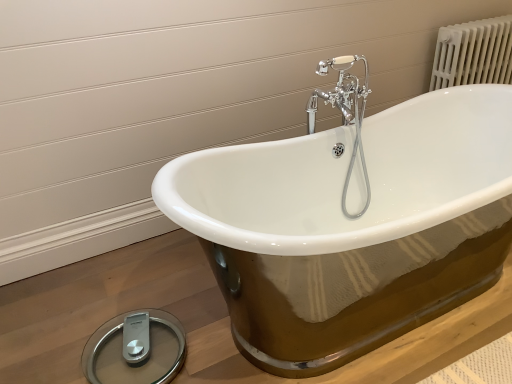
Locate an element on the screen. The height and width of the screenshot is (384, 512). white porcelain bathtub at center is located at coordinates (352, 226).

You are a GUI agent. You are given a task and a screenshot of the screen. Output one action in this format:
    pyautogui.click(x=<x>, y=<y>)
    Task: Click on the silver/glass scale at lower left
    
    Given the screenshot: What is the action you would take?
    pyautogui.click(x=135, y=349)

You are a GUI agent. You are given a task and a screenshot of the screen. Output one action in this format:
    pyautogui.click(x=<x>, y=<y>)
    Task: Click on the scale to the left of chrome/metallic faucet at upper center
    The image size is (512, 384).
    Given the screenshot: What is the action you would take?
    pyautogui.click(x=135, y=349)

Which object is closer to the camera, chrome/metallic faucet at upper center or silver/glass scale at lower left?

silver/glass scale at lower left is more forward.

Is chrome/metallic faucet at upper center to the left of silver/glass scale at lower left from the viewer's perspective?

In fact, chrome/metallic faucet at upper center is to the right of silver/glass scale at lower left.

Would you say chrome/metallic faucet at upper center is outside white porcelain bathtub at center?

Yes.

From their relative heights in the image, would you say chrome/metallic faucet at upper center is taller or shorter than white porcelain bathtub at center?

chrome/metallic faucet at upper center is taller than white porcelain bathtub at center.

From the image's perspective, is chrome/metallic faucet at upper center under white porcelain bathtub at center?

No, from the image's perspective, chrome/metallic faucet at upper center is not below white porcelain bathtub at center.

Considering the positions of points (321, 65) and (229, 176), is point (321, 65) closer to camera compared to point (229, 176)?

Yes, point (321, 65) is in front of point (229, 176).

From a real-world perspective, is white porcelain bathtub at center located beneath silver/glass scale at lower left?

Indeed, from a real-world perspective, white porcelain bathtub at center is positioned beneath silver/glass scale at lower left.

In the image, is white porcelain bathtub at center on the left side or the right side of silver/glass scale at lower left?

white porcelain bathtub at center is positioned on silver/glass scale at lower left's right side.

Which of these two, white porcelain bathtub at center or silver/glass scale at lower left, stands shorter?

white porcelain bathtub at center.

Is point (173, 315) closer to camera compared to point (360, 126)?

Yes, point (173, 315) is in front of point (360, 126).

Consider the image. From the image's perspective, which one is positioned higher, silver/glass scale at lower left or chrome/metallic faucet at upper center?

chrome/metallic faucet at upper center is shown above in the image.

Does silver/glass scale at lower left contain white porcelain bathtub at center?

No, silver/glass scale at lower left does not contain white porcelain bathtub at center.

Does silver/glass scale at lower left come in front of white porcelain bathtub at center?

No.

Who is bigger, silver/glass scale at lower left or white porcelain bathtub at center?

Bigger between the two is white porcelain bathtub at center.

Which is more to the left, white porcelain bathtub at center or chrome/metallic faucet at upper center?

Positioned to the left is chrome/metallic faucet at upper center.

Do you think white porcelain bathtub at center is within chrome/metallic faucet at upper center, or outside of it?

white porcelain bathtub at center is not inside chrome/metallic faucet at upper center, it's outside.

Looking at this image, is chrome/metallic faucet at upper center at the back of white porcelain bathtub at center?

No.

How different are the orientations of white porcelain bathtub at center and chrome/metallic faucet at upper center in degrees?

91.8 degrees separate the facing orientations of white porcelain bathtub at center and chrome/metallic faucet at upper center.

Where is `scale below the chrome/metallic faucet at upper center (from a real-world perspective)`? scale below the chrome/metallic faucet at upper center (from a real-world perspective) is located at coordinates (135, 349).

Locate an element on the screen. The image size is (512, 384). tap located above the white porcelain bathtub at center (from the image's perspective) is located at coordinates (345, 113).

Looking at the image, which one is located further to white porcelain bathtub at center, silver/glass scale at lower left or chrome/metallic faucet at upper center?

silver/glass scale at lower left is positioned further to the anchor white porcelain bathtub at center.

Looking at the image, which one is located further to chrome/metallic faucet at upper center, white porcelain bathtub at center or silver/glass scale at lower left?

The object further to chrome/metallic faucet at upper center is silver/glass scale at lower left.

When comparing their distances from silver/glass scale at lower left, does chrome/metallic faucet at upper center or white porcelain bathtub at center seem closer?

The object closer to silver/glass scale at lower left is white porcelain bathtub at center.

Which object lies further to the anchor point chrome/metallic faucet at upper center, silver/glass scale at lower left or white porcelain bathtub at center?

silver/glass scale at lower left lies further to chrome/metallic faucet at upper center than the other object.

Looking at the image, which one is located closer to silver/glass scale at lower left, white porcelain bathtub at center or chrome/metallic faucet at upper center?

Based on the image, white porcelain bathtub at center appears to be nearer to silver/glass scale at lower left.

Based on their spatial positions, is chrome/metallic faucet at upper center or silver/glass scale at lower left closer to white porcelain bathtub at center?

Based on the image, chrome/metallic faucet at upper center appears to be nearer to white porcelain bathtub at center.

The width and height of the screenshot is (512, 384). Identify the location of tap between silver/glass scale at lower left and white porcelain bathtub at center in the horizontal direction. (345, 113).